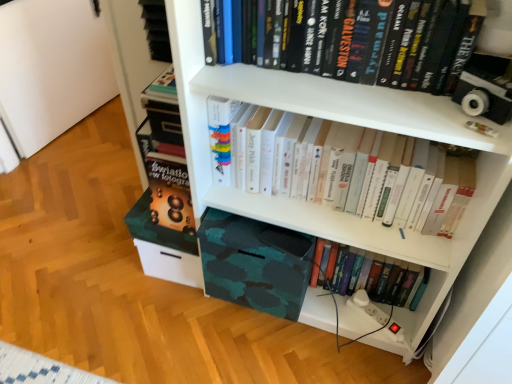
Question: From a real-world perspective, is hardcover books at upper center, arranged as the third book when ordered from the bottom, on camo fabric box at lower center?

Choices:
 (A) yes
 (B) no

Answer: (A)

Question: Is hardcover books at upper center, which appears as the 1th book when viewed from the top, to the left of camo fabric box at lower center from the viewer's perspective?

Choices:
 (A) yes
 (B) no

Answer: (B)

Question: From a real-world perspective, is hardcover books at upper center, which appears as the 1th book when viewed from the top, below camo fabric box at lower center?

Choices:
 (A) no
 (B) yes

Answer: (A)

Question: Is hardcover books at upper center, arranged as the third book when ordered from the bottom, positioned behind camo fabric box at lower center?

Choices:
 (A) yes
 (B) no

Answer: (B)

Question: Is hardcover books at upper center, which appears as the 1th book when viewed from the top, smaller than camo fabric box at lower center?

Choices:
 (A) no
 (B) yes

Answer: (B)

Question: Is camo fabric box at lower center wider or thinner than hardcover books at upper center, which appears as the 1th book when viewed from the top?

Choices:
 (A) wide
 (B) thin

Answer: (A)

Question: Does point (270, 261) appear closer or farther from the camera than point (352, 31)?

Choices:
 (A) farther
 (B) closer

Answer: (A)

Question: Relative to hardcover books at upper center, which appears as the 1th book when viewed from the top, is camo fabric box at lower center in front or behind?

Choices:
 (A) front
 (B) behind

Answer: (B)

Question: In the image, is camo fabric box at lower center on the left side or the right side of hardcover books at upper center, which appears as the 1th book when viewed from the top?

Choices:
 (A) right
 (B) left

Answer: (B)

Question: Is hardcover book at lower center, the 3th book when ordered from top to bottom, taller or shorter than hardcover books at upper center, which appears as the 1th book when viewed from the top?

Choices:
 (A) short
 (B) tall

Answer: (B)

Question: Is hardcover book at lower center, the 3th book when ordered from top to bottom, wider or thinner than hardcover books at upper center, which appears as the 1th book when viewed from the top?

Choices:
 (A) thin
 (B) wide

Answer: (A)

Question: Is point (429, 269) positioned closer to the camera than point (354, 31)?

Choices:
 (A) closer
 (B) farther

Answer: (B)

Question: Considering their positions, is hardcover book at lower center, the 3th book when ordered from top to bottom, located in front of or behind hardcover books at upper center, arranged as the third book when ordered from the bottom?

Choices:
 (A) behind
 (B) front

Answer: (A)

Question: From a real-world perspective, relative to white paper book at center, the second book in the top-to-bottom sequence, is hardcover book at lower center, which is counted as the first book, starting from the bottom, vertically above or below?

Choices:
 (A) above
 (B) below

Answer: (B)

Question: Is hardcover book at lower center, the 3th book when ordered from top to bottom, inside the boundaries of white paper book at center, the second book in the top-to-bottom sequence, or outside?

Choices:
 (A) outside
 (B) inside

Answer: (A)